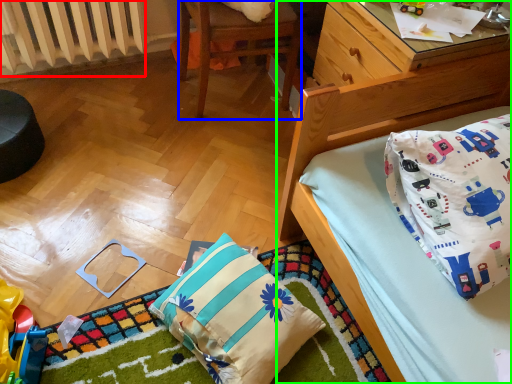
Question: Considering the real-world distances, which object is closest to radiator (highlighted by a red box)? chair (highlighted by a blue box) or bed (highlighted by a green box).

Choices:
 (A) chair
 (B) bed

Answer: (A)